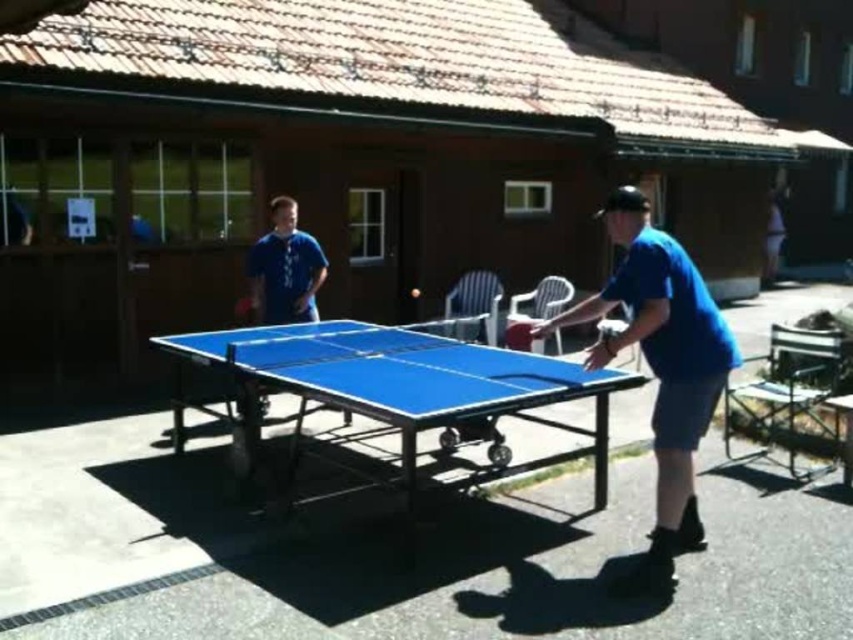
Is blue plastic table at center below blue fabric shorts at lower right?

Yes.

Which is below, blue plastic table at center or blue fabric shorts at lower right?

Positioned lower is blue plastic table at center.

This screenshot has width=853, height=640. I want to click on blue plastic table at center, so click(x=393, y=390).

Locate an element on the screen. This screenshot has width=853, height=640. blue plastic table at center is located at coordinates (393, 390).

Can you confirm if blue plastic table at center is taller than blue matte shirt at upper left?

Yes.

How distant is blue plastic table at center from blue matte shirt at upper left?

blue plastic table at center is 3.95 feet from blue matte shirt at upper left.

Between point (357, 346) and point (277, 220), which one is positioned behind?

The point (277, 220) is behind.

Find the location of `blue plastic table at center`. blue plastic table at center is located at coordinates (393, 390).

Can you confirm if blue matte shirt at center is thinner than blue fabric shorts at lower right?

No.

Between blue matte shirt at center and blue fabric shorts at lower right, which one appears on the left side from the viewer's perspective?

From the viewer's perspective, blue matte shirt at center appears more on the left side.

Where is `blue matte shirt at center`? This screenshot has height=640, width=853. blue matte shirt at center is located at coordinates (660, 365).

The height and width of the screenshot is (640, 853). I want to click on blue matte shirt at center, so click(660, 365).